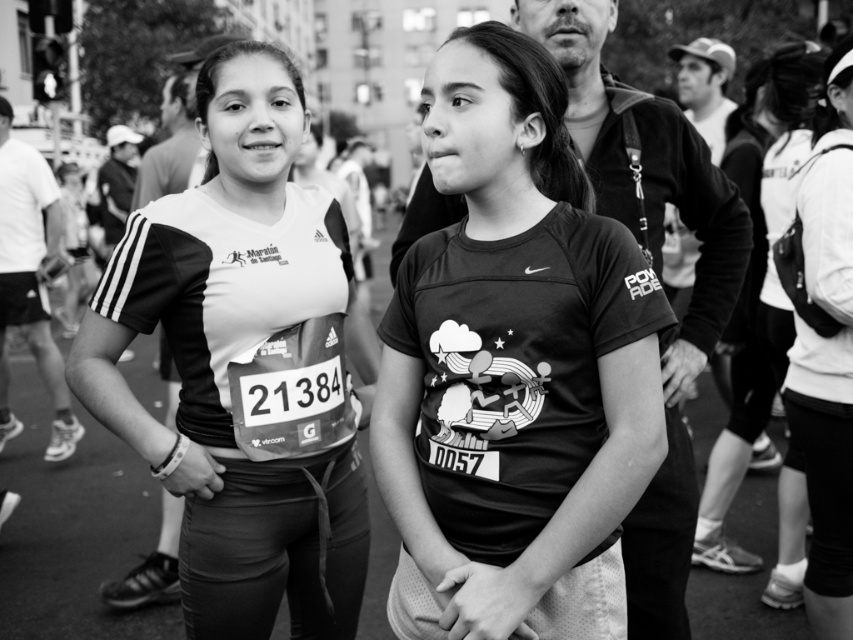
Is matte black t-shirt at center wider than white fabric backpack at right?

Yes, matte black t-shirt at center is wider than white fabric backpack at right.

Measure the distance between matte black t-shirt at center and white fabric backpack at right.

A distance of 1.63 meters exists between matte black t-shirt at center and white fabric backpack at right.

Between point (486, 92) and point (840, 269), which one is positioned in front?

Point (486, 92)

Identify the location of matte black t-shirt at center. The height and width of the screenshot is (640, 853). (514, 369).

Can you confirm if matte black shirt at center is shorter than white cotton hoodie at right?

Correct, matte black shirt at center is not as tall as white cotton hoodie at right.

Does matte black shirt at center have a larger size compared to white cotton hoodie at right?

Actually, matte black shirt at center might be smaller than white cotton hoodie at right.

Where is `matte black shirt at center`? The image size is (853, 640). matte black shirt at center is located at coordinates (229, 356).

I want to click on matte black shirt at center, so click(229, 356).

Between white fabric backpack at right and white cotton hoodie at right, which one appears on the right side from the viewer's perspective?

white cotton hoodie at right is more to the right.

Can you confirm if white fabric backpack at right is taller than white cotton hoodie at right?

No.

Is point (836, 444) positioned before point (785, 195)?

Yes, point (836, 444) is closer to viewer.

Identify the location of white fabric backpack at right. The height and width of the screenshot is (640, 853). (827, 352).